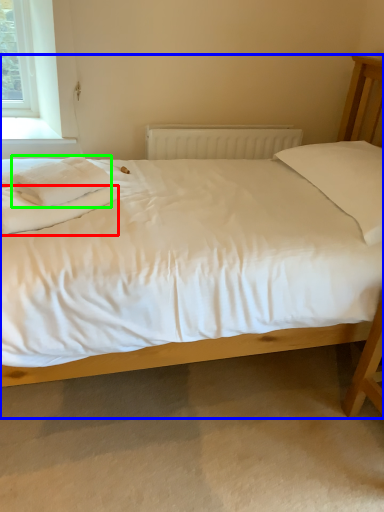
Question: Which is farther away from sheet (highlighted by a red box)? bed (highlighted by a blue box) or material (highlighted by a green box)?

Choices:
 (A) bed
 (B) material

Answer: (A)